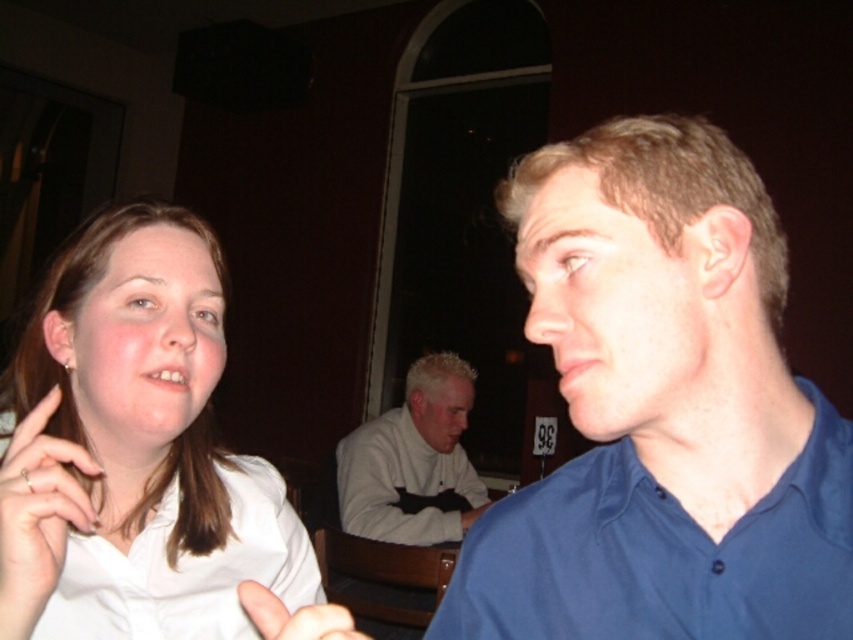
Is white sweater at center above white matte hand at lower left?

No.

Does white sweater at center have a lesser width compared to white matte hand at lower left?

No, white sweater at center is not thinner than white matte hand at lower left.

Who is more forward, (407,416) or (349,621)?

Positioned in front is point (349,621).

You are a GUI agent. You are given a task and a screenshot of the screen. Output one action in this format:
    pyautogui.click(x=<x>, y=<y>)
    Task: Click on the white sweater at center
    Image resolution: width=853 pixels, height=640 pixels.
    Given the screenshot: What is the action you would take?
    pyautogui.click(x=413, y=461)

How far apart are blue cotton shirt at right and white matte hand at lower left?

The distance of blue cotton shirt at right from white matte hand at lower left is 18.48 centimeters.

Who is more distant from viewer, (x=625, y=516) or (x=256, y=589)?

The point (x=625, y=516) is behind.

Who is more forward, (833, 582) or (323, 612)?

→ Point (323, 612) is more forward.

The image size is (853, 640). I want to click on blue cotton shirt at right, so click(660, 554).

Looking at this image, does white matte shirt at left have a smaller size compared to white matte hand at lower left?

No, white matte shirt at left is not smaller than white matte hand at lower left.

Is point (93, 550) positioned after point (349, 624)?

Yes, point (93, 550) is behind point (349, 624).

Does point (97, 570) come behind point (332, 620)?

Yes, it is behind point (332, 620).

This screenshot has height=640, width=853. I want to click on white matte shirt at left, so click(131, 438).